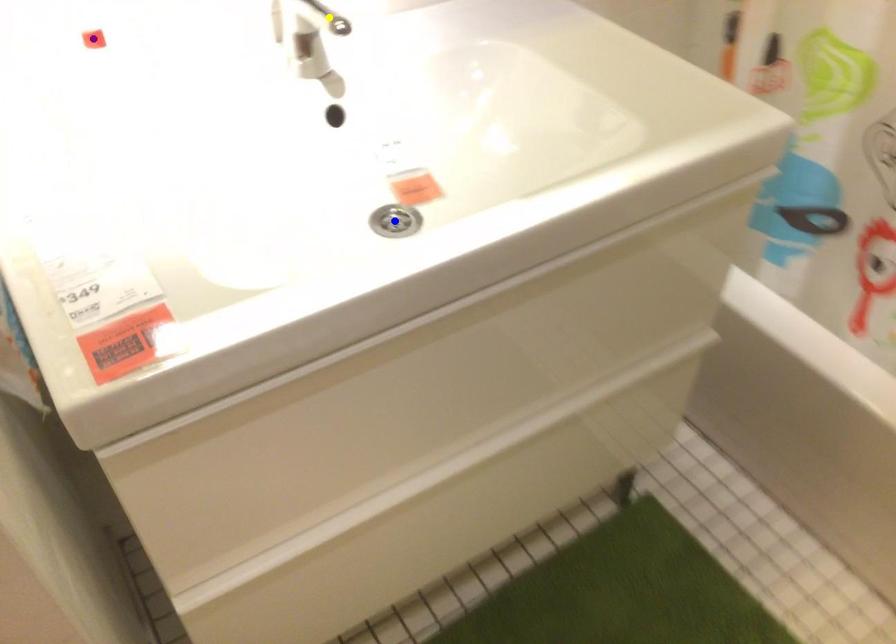
Order these from nearest to farthest:
purple point
yellow point
blue point

purple point → blue point → yellow point